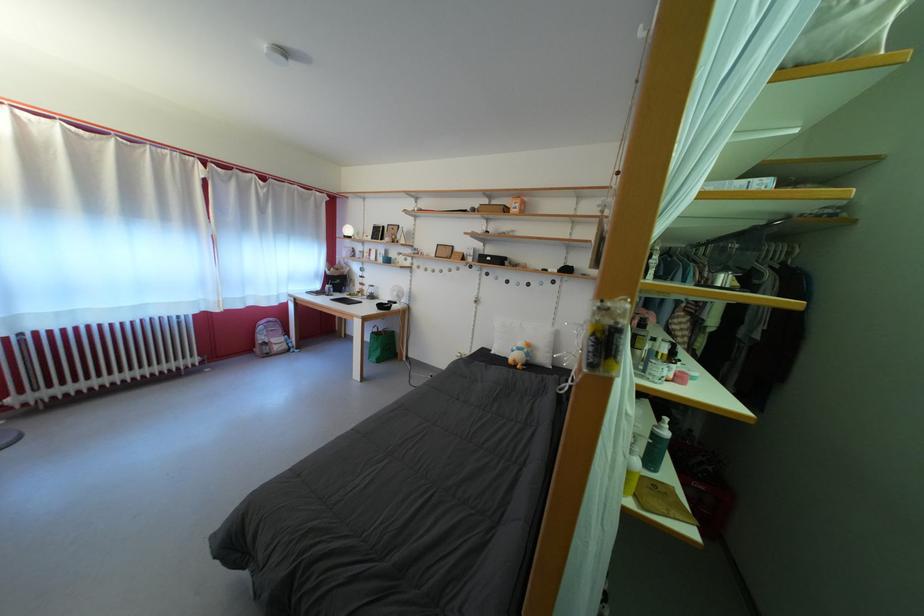
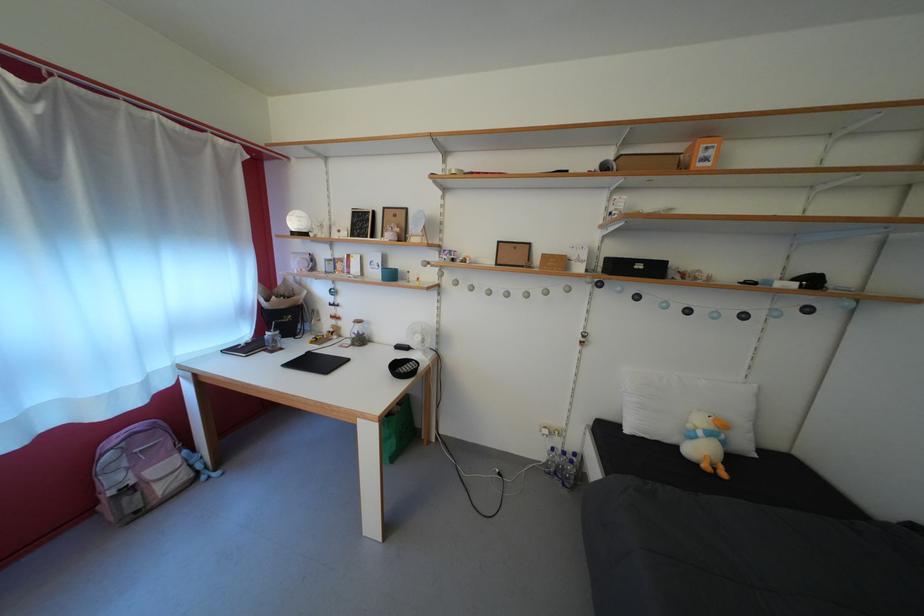
Which direction would the cameraman need to move to produce the second image?

The movement direction of the cameraman is left, forward.